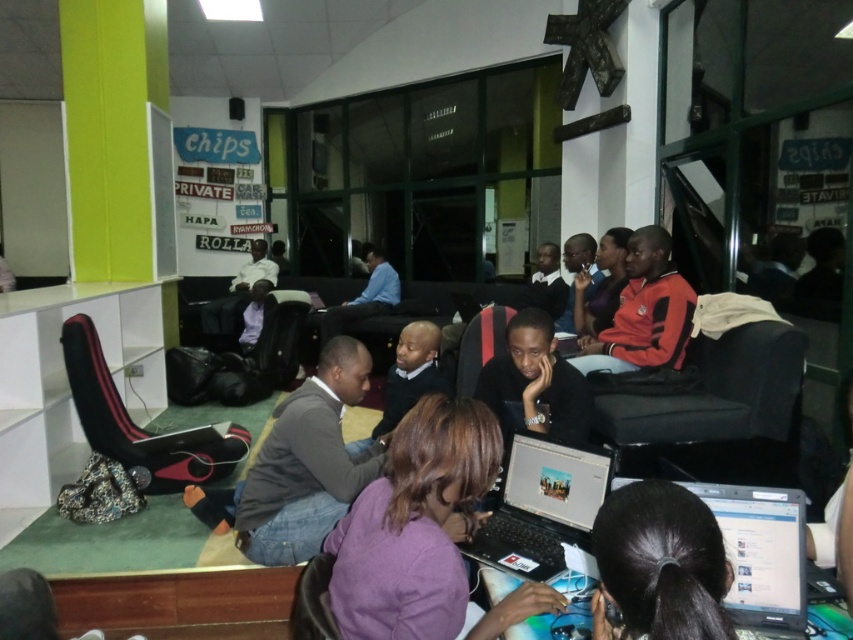
You are a visitor in this space and need to locate the purple matte laptop at center. According to the coordinates provided, where should you look to find it?

The purple matte laptop at center is located at coordinates point (413,525).

You are standing at the entrance of the room and want to locate the silver metallic laptop at center. According to the coordinates provided, in which direction should you move from your current position to reach it?

The silver metallic laptop at center is located at coordinates point (541, 506). Since you are at the entrance, moving towards the center of the room would place you closer to the laptop.

You are a delivery person who needs to place a package between the purple matte laptop at center and the green pillar on the left. The package requires a minimum of 4 feet of space to be safely placed. Can you fit it there?

→ The distance between the purple matte laptop at center and the green pillar on the left is 4.12 feet, which is just enough to accommodate the package requiring 4 feet of space. Yes, you can safely place the package there.